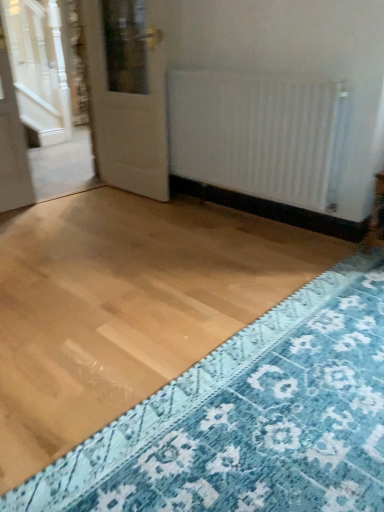
Question: Does white glossy door at upper left come in front of blue textured rug at lower right?

Choices:
 (A) no
 (B) yes

Answer: (A)

Question: From a real-world perspective, is white glossy door at upper left positioned under blue textured rug at lower right based on gravity?

Choices:
 (A) no
 (B) yes

Answer: (A)

Question: Is blue textured rug at lower right at the back of white glossy door at upper left?

Choices:
 (A) yes
 (B) no

Answer: (B)

Question: Does white glossy door at upper left have a smaller size compared to blue textured rug at lower right?

Choices:
 (A) no
 (B) yes

Answer: (A)

Question: From a real-world perspective, is white glossy door at upper left on blue textured rug at lower right?

Choices:
 (A) no
 (B) yes

Answer: (B)

Question: From the image's perspective, is blue textured rug at lower right positioned above or below white matte radiator at center?

Choices:
 (A) below
 (B) above

Answer: (A)

Question: In terms of height, does blue textured rug at lower right look taller or shorter compared to white matte radiator at center?

Choices:
 (A) short
 (B) tall

Answer: (A)

Question: Is point (382, 292) positioned closer to the camera than point (203, 110)?

Choices:
 (A) closer
 (B) farther

Answer: (A)

Question: Considering their positions, is blue textured rug at lower right located in front of or behind white matte radiator at center?

Choices:
 (A) behind
 (B) front

Answer: (B)

Question: Is white matte radiator at center situated inside blue textured rug at lower right or outside?

Choices:
 (A) outside
 (B) inside

Answer: (A)

Question: From their relative heights in the image, would you say white matte radiator at center is taller or shorter than blue textured rug at lower right?

Choices:
 (A) tall
 (B) short

Answer: (A)

Question: From the image's perspective, is white matte radiator at center positioned above or below blue textured rug at lower right?

Choices:
 (A) below
 (B) above

Answer: (B)

Question: Considering the positions of white matte radiator at center and blue textured rug at lower right in the image, is white matte radiator at center bigger or smaller than blue textured rug at lower right?

Choices:
 (A) small
 (B) big

Answer: (B)

Question: From the image's perspective, relative to white matte radiator at center, is white glossy door at upper left above or below?

Choices:
 (A) above
 (B) below

Answer: (A)

Question: From a real-world perspective, is white glossy door at upper left above or below white matte radiator at center?

Choices:
 (A) above
 (B) below

Answer: (A)